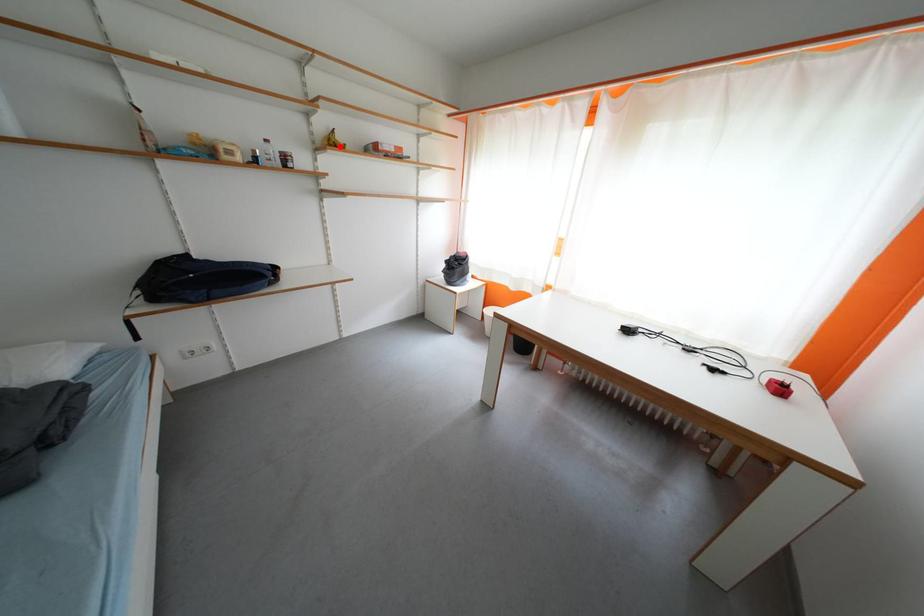
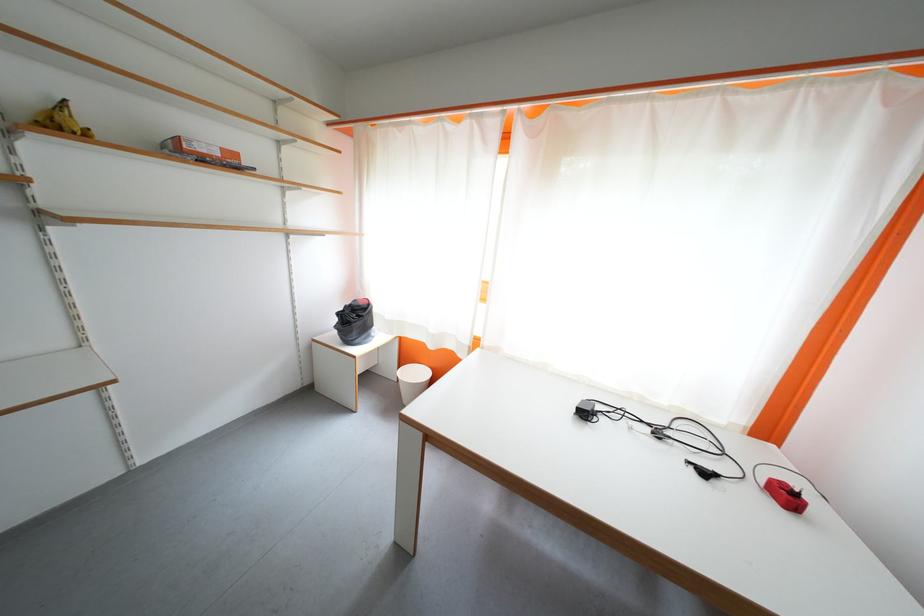
Locate, in the second image, the point that corresponds to the highlighted location in the first image.

(68, 129)